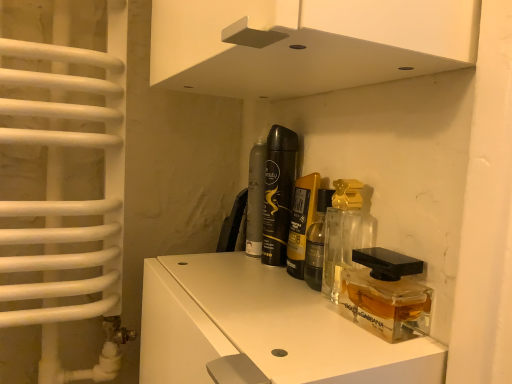
Question: Is translucent glass perfume at center, the 2th perfume when ordered from back to front, wider or thinner than matte black perfume at center, positioned as the 1th perfume in back-to-front order?

Choices:
 (A) thin
 (B) wide

Answer: (A)

Question: From a real-world perspective, is translucent glass perfume at center, the 2th perfume when ordered from back to front, physically located above or below matte black perfume at center, positioned as the 1th perfume in back-to-front order?

Choices:
 (A) below
 (B) above

Answer: (B)

Question: Which object is the closest to the transparent glass perfume bottles at center?

Choices:
 (A) clear glass perfume at center, placed as the 3th perfume when sorted from back to front
 (B) clear glass perfume at center, which ranks as the 1th perfume in front-to-back order
 (C) translucent glass perfume at center, placed as the third perfume when sorted from front to back
 (D) matte black perfume at center, positioned as the 1th perfume in back-to-front order
 (E) transparent plastic perfume bottle at center

Answer: (E)

Question: Estimate the real-world distances between objects in this image. Which object is closer to the matte black perfume at center, the fourth perfume when ordered from front to back?

Choices:
 (A) translucent glass perfume at center, the 2th perfume when ordered from back to front
 (B) transparent plastic perfume bottle at center
 (C) clear glass perfume at center, placed as the 3th perfume when sorted from back to front
 (D) transparent glass perfume bottles at center
 (E) clear glass perfume at center, which ranks as the 1th perfume in front-to-back order

Answer: (A)